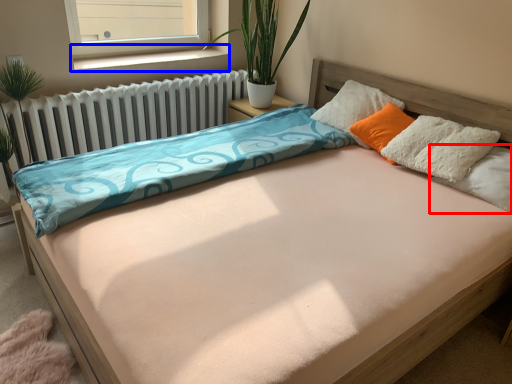
Question: Which object appears farthest to the camera in this image, pillow (highlighted by a red box) or window sill (highlighted by a blue box)?

Choices:
 (A) pillow
 (B) window sill

Answer: (B)